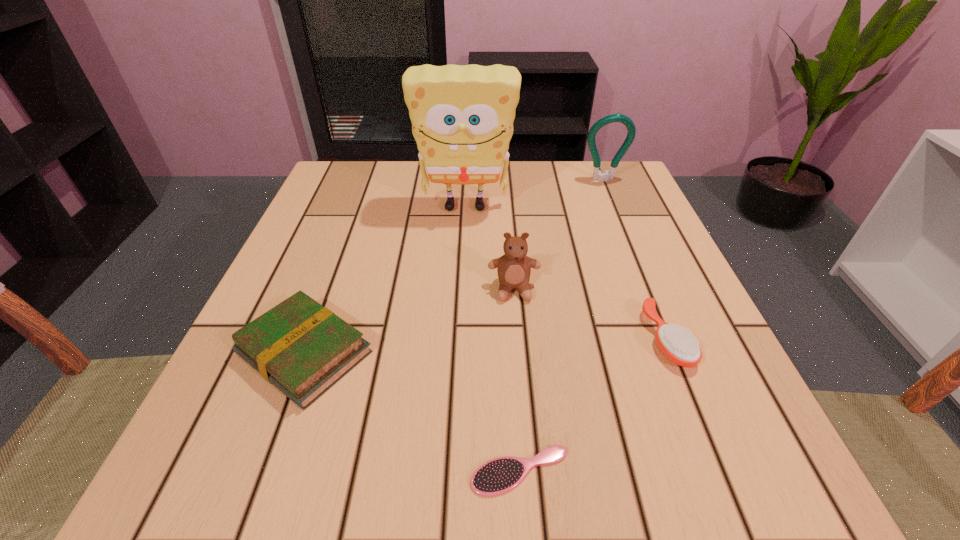
I want to click on object that stands as the second closest to the tallest object, so click(597, 174).

Select which object is the fifth closest to the fifth shortest object. Please provide its 2D coordinates. Your answer should be formatted as a tuple, i.e. [(x, y)], where the tuple contains the x and y coordinates of a point satisfying the conditions above.

[(500, 475)]

The height and width of the screenshot is (540, 960). I want to click on free region that satisfies the following two spatial constraints: 1. on the face of the shorter hairbrush; 2. on the left side of the tallest object, so click(453, 471).

Where is `vacant space that satisfies the following two spatial constraints: 1. on the face of the sponge; 2. on the left side of the taller hairbrush`? vacant space that satisfies the following two spatial constraints: 1. on the face of the sponge; 2. on the left side of the taller hairbrush is located at coordinates (459, 338).